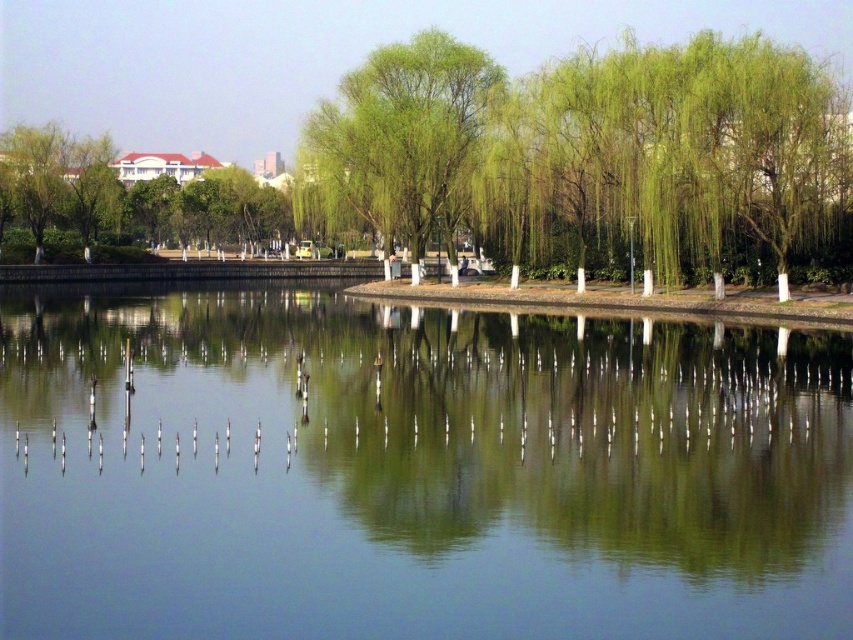
Is green leafy willow at center behind green leafy tree at upper left?

No, green leafy willow at center is in front of green leafy tree at upper left.

Who is taller, green leafy willow at center or green leafy tree at upper left?

Standing taller between the two is green leafy tree at upper left.

Identify the location of green leafy willow at center. (402, 138).

Does clear water at center appear on the left side of green leafy willow at center?

In fact, clear water at center is to the right of green leafy willow at center.

Is point (589, 394) farther from camera compared to point (476, 106)?

No, it is not.

Which is behind, point (321, 406) or point (425, 180)?

Point (425, 180)

Locate an element on the screen. The height and width of the screenshot is (640, 853). clear water at center is located at coordinates (415, 472).

Can you confirm if clear water at center is taller than green leafy tree at upper left?

Incorrect, clear water at center's height is not larger of green leafy tree at upper left's.

Who is more forward, (x=508, y=504) or (x=149, y=211)?

Point (x=508, y=504) is in front.

Find the location of a particular element. clear water at center is located at coordinates (415, 472).